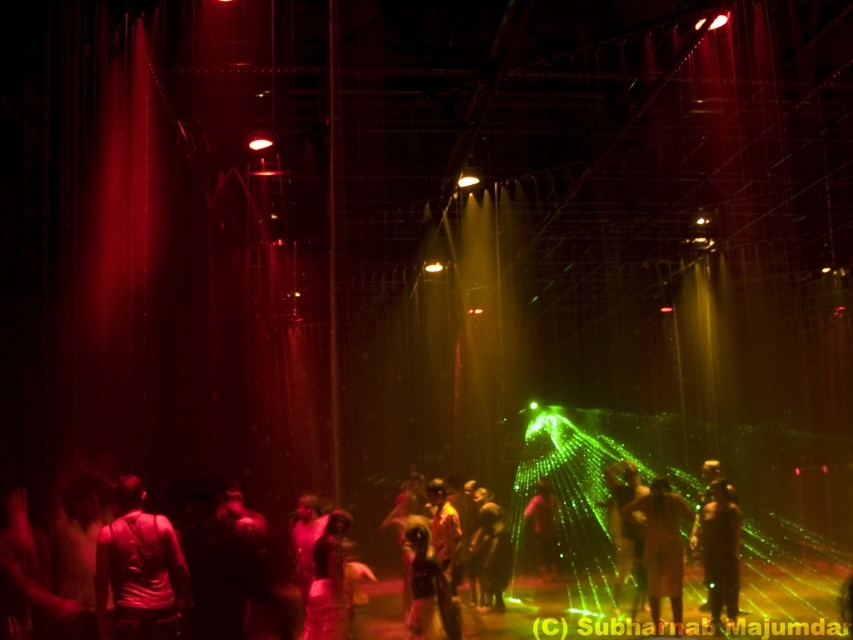
Question: Which object is the farthest from the silky brown dress at center?

Choices:
 (A) dark matte clothing at center
 (B) matte black shirt at center

Answer: (A)

Question: Which point is farther to the camera?

Choices:
 (A) silky brown dress at center
 (B) pink fabric person at center
 (C) metallic gold person at center

Answer: (B)

Question: Can you confirm if matte black shirt at lower left is bigger than shiny metallic dress at center?

Choices:
 (A) no
 (B) yes

Answer: (A)

Question: Which point is farther to the camera?

Choices:
 (A) (669, 538)
 (B) (724, 504)
 (C) (505, 547)
 (D) (613, 504)

Answer: (C)

Question: Is matte black shirt at lower left closer to the viewer compared to pink fabric person at center?

Choices:
 (A) no
 (B) yes

Answer: (B)

Question: Does dark matte clothing at center appear on the left side of pink fabric person at center?

Choices:
 (A) yes
 (B) no

Answer: (A)